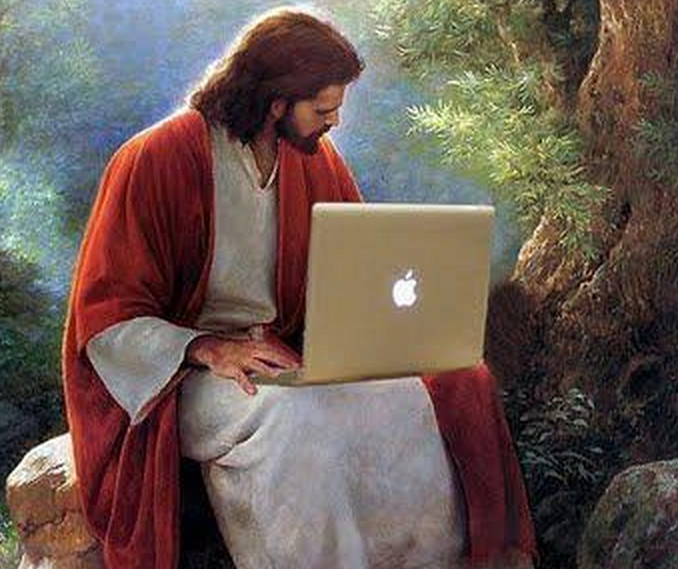
The width and height of the screenshot is (678, 569). What are the coordinates of `area for typing` in the screenshot? It's located at (285, 374).